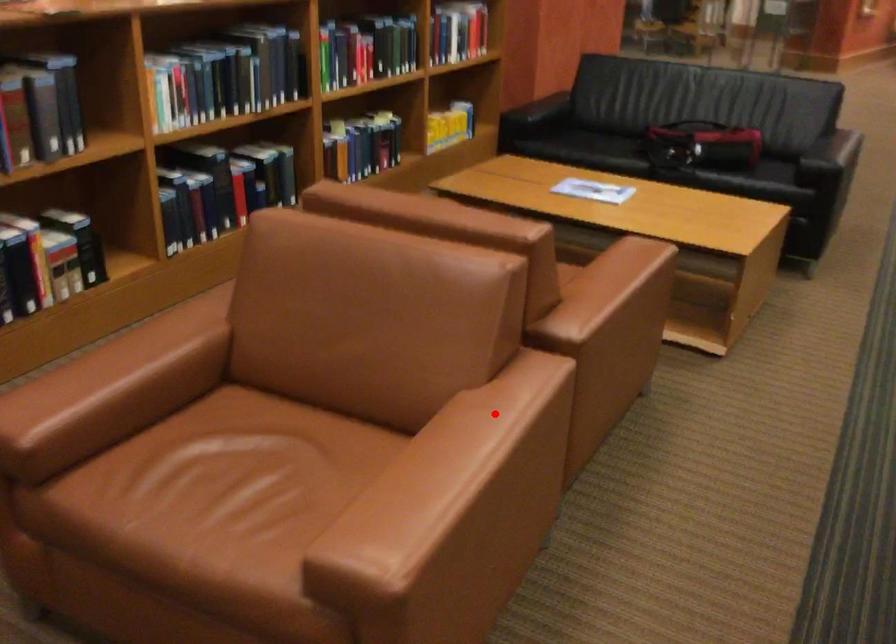
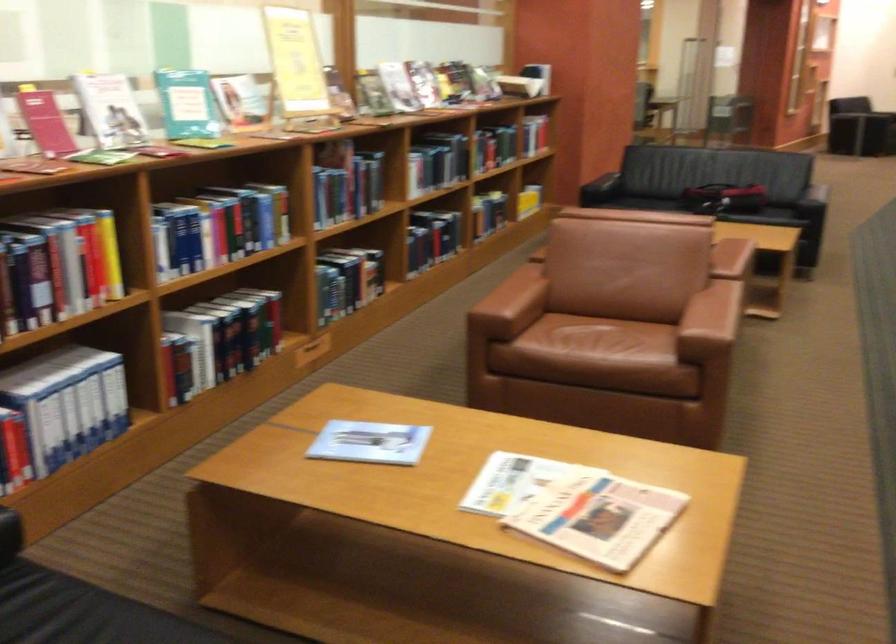
Question: I am providing you with two images of the same scene from different viewpoints. Given a red point in image1, look at the same physical point in image2. Is it:

Choices:
 (A) Closer to the viewpoint
 (B) Farther from the viewpoint

Answer: (B)